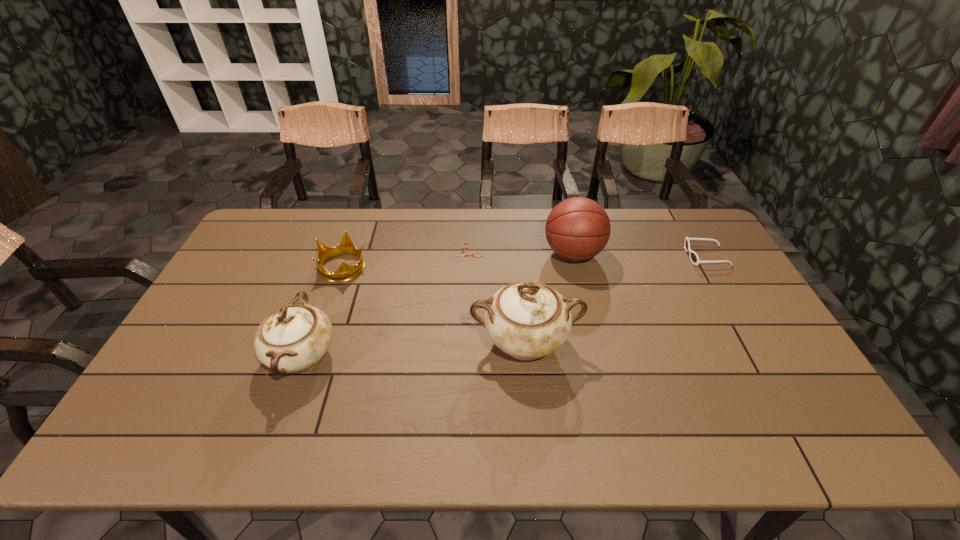
This screenshot has height=540, width=960. Identify the location of free space located with the lenses of the sunglasses facing outward. (648, 256).

Identify the location of vacant space situated with the lenses of the sunglasses facing outward. Image resolution: width=960 pixels, height=540 pixels. (597, 256).

You are a GUI agent. You are given a task and a screenshot of the screen. Output one action in this format:
    pyautogui.click(x=<x>, y=<y>)
    Task: Click on the vacant space located on the front of the crown
    
    Given the screenshot: What is the action you would take?
    pyautogui.click(x=313, y=356)

I want to click on vacant space located 0.320m on the front of the basketball, so (597, 355).

The width and height of the screenshot is (960, 540). In order to click on free space located on the front of the shortest object in this screenshot , I will do `click(466, 309)`.

Where is `sunglasses that is at the far edge`? This screenshot has height=540, width=960. sunglasses that is at the far edge is located at coordinates (694, 258).

The width and height of the screenshot is (960, 540). Find the location of `basketball that is at the far edge`. basketball that is at the far edge is located at coordinates (577, 229).

In order to click on shears at the far edge in this screenshot , I will do `click(462, 254)`.

Where is `object positioned at the near edge`? object positioned at the near edge is located at coordinates (294, 338).

You are a GUI agent. You are given a task and a screenshot of the screen. Output one action in this format:
    pyautogui.click(x=<x>, y=<y>)
    Task: Click on the object that is at the right edge
    Image resolution: width=960 pixels, height=540 pixels.
    Given the screenshot: What is the action you would take?
    pyautogui.click(x=694, y=258)